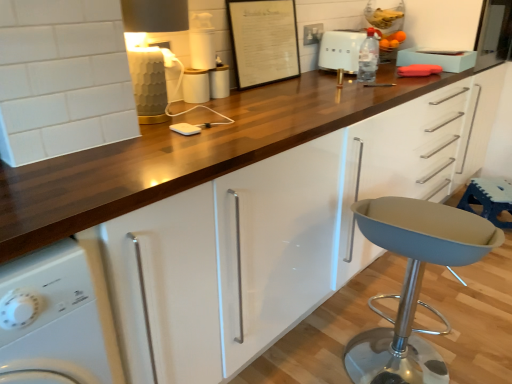
Where is `vacant space behind matte gray stool at lower right`? This screenshot has height=384, width=512. vacant space behind matte gray stool at lower right is located at coordinates (382, 311).